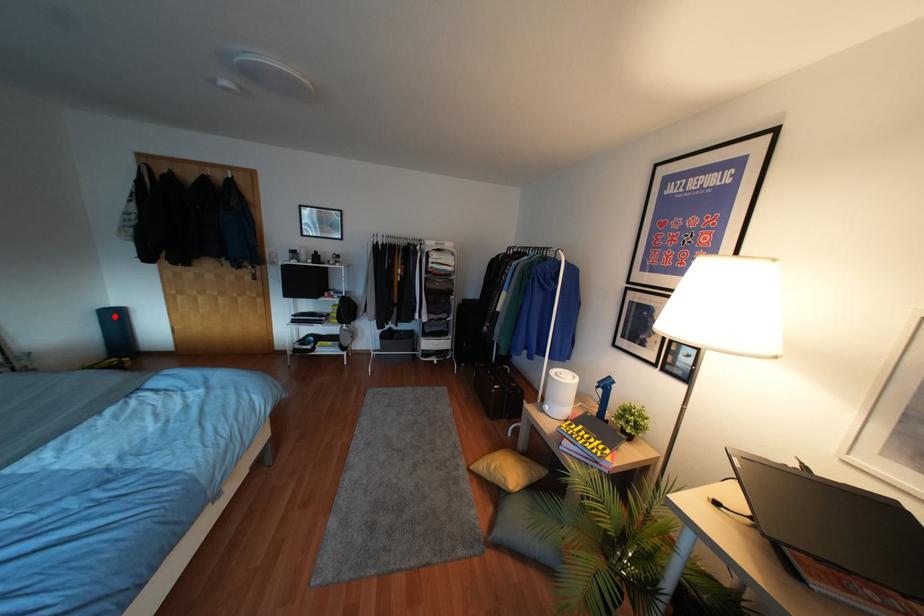
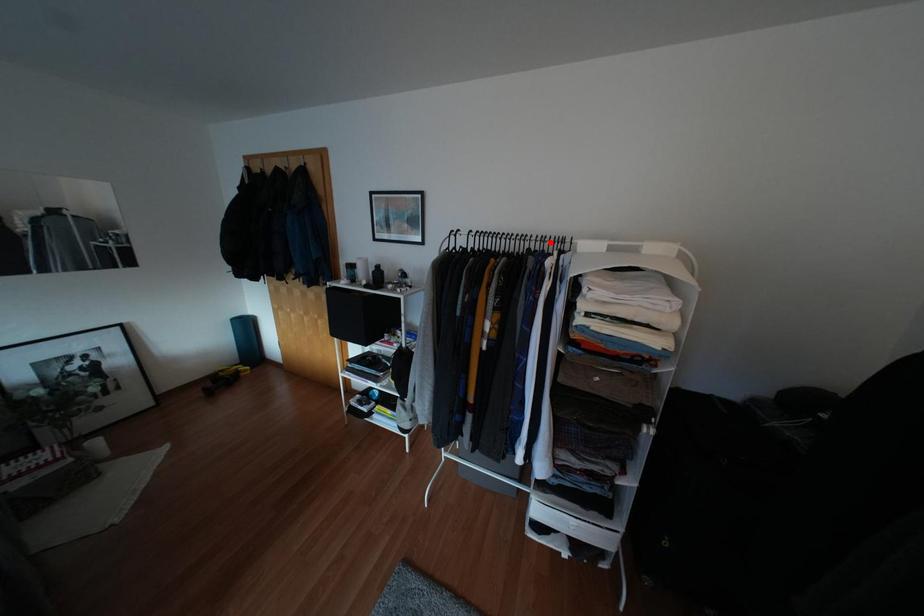
I am providing you with two images of the same scene from different viewpoints. A red point is marked on the first image and another point is marked on the second image. Are the points marked in image1 and image2 representing the same 3D position?

No